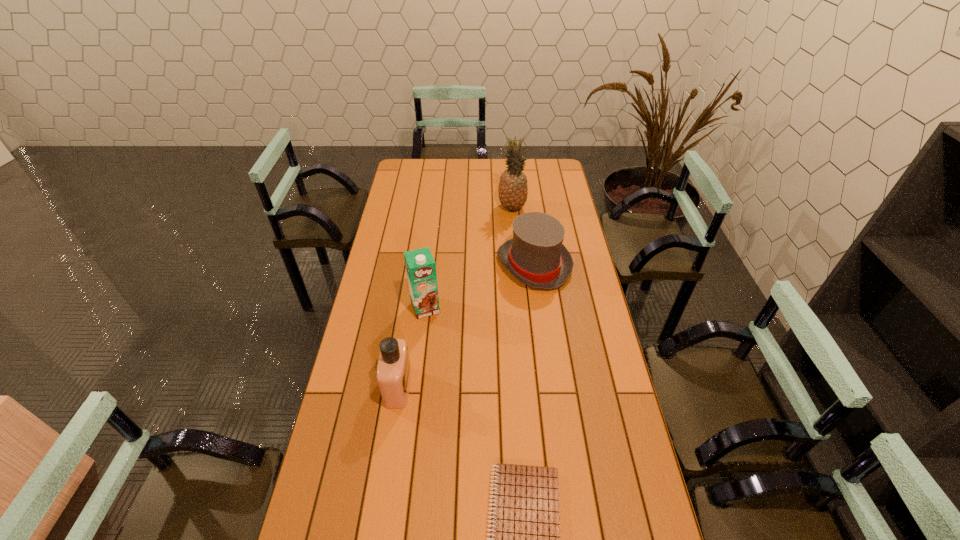
At what (x,y) coordinates should I click in order to perform the action: click on object that is at the left edge. Please return your answer as a coordinate pair (x, y). Looking at the image, I should click on (393, 370).

Where is `object situated at the right edge`? The height and width of the screenshot is (540, 960). object situated at the right edge is located at coordinates 535,256.

Locate an element on the screen. vacant space at the far edge of the desktop is located at coordinates (472, 161).

In the image, there is a desktop. Find the location of `vacant area at the left edge`. vacant area at the left edge is located at coordinates (345, 380).

I want to click on vacant space at the right edge of the desktop, so click(x=554, y=189).

This screenshot has width=960, height=540. I want to click on free space at the far right corner, so click(542, 172).

Identify the location of free space between the second nearest object and the farthest object. The width and height of the screenshot is (960, 540). [x=455, y=297].

You are a GUI agent. You are given a task and a screenshot of the screen. Output one action in this format:
    pyautogui.click(x=<x>, y=<y>)
    Task: Click on the vacant area that lies between the fourth shortest object and the pineapple
    The width and height of the screenshot is (960, 540).
    Given the screenshot: What is the action you would take?
    pyautogui.click(x=468, y=258)

This screenshot has width=960, height=540. Identify the location of empty location between the second nearest object and the pineapple. (455, 297).

Select which object is the second closest to the second tallest object. Please provide its 2D coordinates. Your answer should be formatted as a tuple, i.e. [(x, y)], where the tuple contains the x and y coordinates of a point satisfying the conditions above.

[(535, 256)]